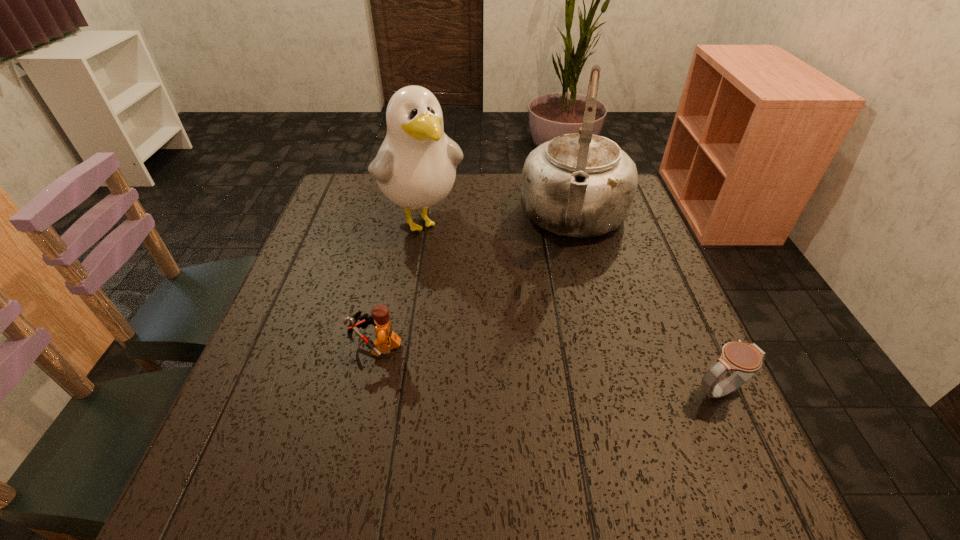
The image size is (960, 540). In order to click on object located at the far right corner in this screenshot , I will do `click(580, 185)`.

Identify the location of object at the near right corner. The image size is (960, 540). (746, 359).

The height and width of the screenshot is (540, 960). In the image, there is a desktop. Find the location of `vacant space at the far edge`. vacant space at the far edge is located at coordinates (469, 186).

Find the location of a particular element. vacant region at the near edge of the desktop is located at coordinates (318, 448).

In the image, there is a desktop. What are the coordinates of `vacant space at the left edge` in the screenshot? It's located at (303, 374).

Locate an element on the screen. The image size is (960, 540). vacant area at the right edge is located at coordinates (636, 306).

In the image, there is a desktop. Where is `free region at the far left corner`? free region at the far left corner is located at coordinates (372, 216).

At what (x,y) coordinates should I click in order to perform the action: click on vacant space at the near right corner of the desktop. Please return your answer as a coordinate pair (x, y). The image size is (960, 540). Looking at the image, I should click on (660, 422).

Where is `blank region between the kettle and the Lego`? The width and height of the screenshot is (960, 540). blank region between the kettle and the Lego is located at coordinates (475, 283).

Locate an element on the screen. Image resolution: width=960 pixels, height=540 pixels. free spot between the kettle and the gull is located at coordinates (498, 219).